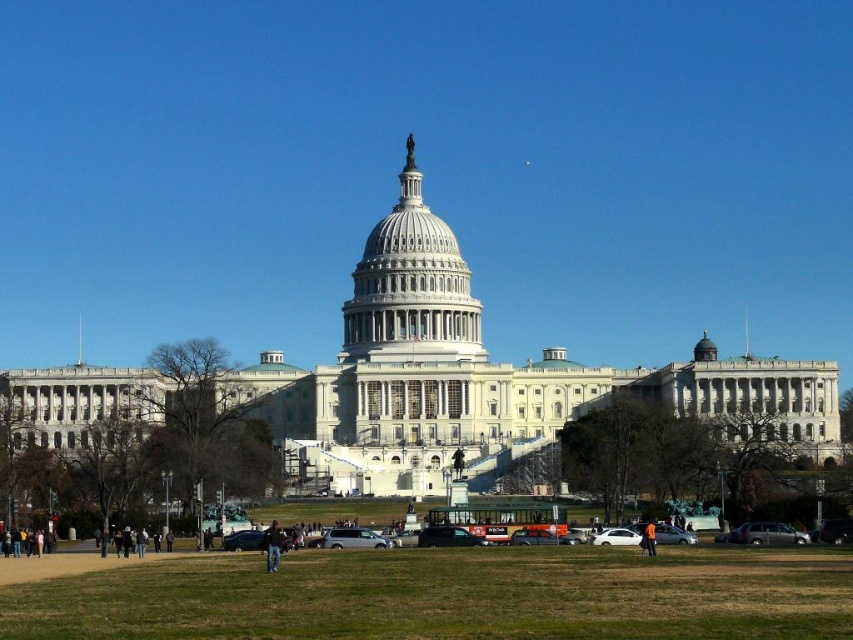
You are a GUI agent. You are given a task and a screenshot of the screen. Output one action in this format:
    pyautogui.click(x=<x>, y=<y>)
    Task: Click on the black fabric jacket at lower center
    
    Given the screenshot: What is the action you would take?
    pyautogui.click(x=273, y=545)

Between black fabric jacket at lower center and orange fabric person at lower right, which one has less height?

orange fabric person at lower right is shorter.

What do you see at coordinates (273, 545) in the screenshot?
I see `black fabric jacket at lower center` at bounding box center [273, 545].

Image resolution: width=853 pixels, height=640 pixels. I want to click on black fabric jacket at lower center, so click(x=273, y=545).

Can you confirm if white marble dome at center is bigger than black fabric jacket at lower center?

Correct, white marble dome at center is larger in size than black fabric jacket at lower center.

Looking at this image, which is more to the left, white marble dome at center or black fabric jacket at lower center?

black fabric jacket at lower center is more to the left.

Which is in front, point (375, 314) or point (265, 548)?

Point (265, 548) is in front.

Locate an element on the screen. white marble dome at center is located at coordinates (410, 288).

Does white marble dome at center have a greater width compared to orange fabric person at lower right?

Indeed, white marble dome at center has a greater width compared to orange fabric person at lower right.

Which is behind, point (450, 298) or point (643, 554)?

Positioned behind is point (450, 298).

You are a GUI agent. You are given a task and a screenshot of the screen. Output one action in this format:
    pyautogui.click(x=<x>, y=<y>)
    Task: Click on the white marble dome at center
    
    Given the screenshot: What is the action you would take?
    pyautogui.click(x=410, y=288)